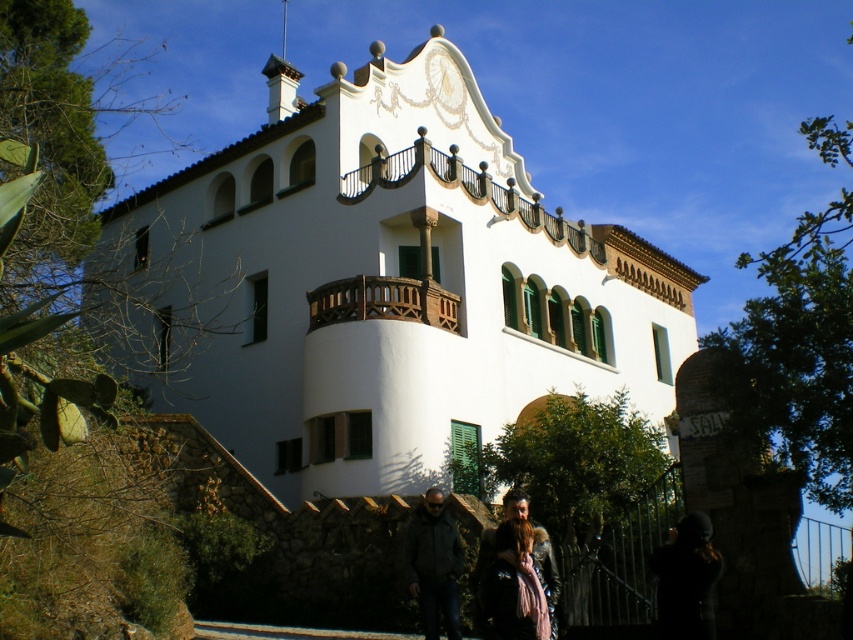
Question: Is white stucco building at center below leather jacket at lower center?

Choices:
 (A) yes
 (B) no

Answer: (B)

Question: Among these points, which one is nearest to the camera?

Choices:
 (A) (413, 548)
 (B) (718, 556)
 (C) (378, 456)
 (D) (514, 612)

Answer: (B)

Question: Can you confirm if white stucco building at center is positioned above dark gray jacket at center?

Choices:
 (A) no
 (B) yes

Answer: (B)

Question: Which object appears closest to the camera in this image?

Choices:
 (A) dark gray jacket at center
 (B) dark woolen hat at lower right
 (C) white stucco building at center

Answer: (B)

Question: Is dark woolen hat at lower right to the left of leather jacket at lower center from the viewer's perspective?

Choices:
 (A) no
 (B) yes

Answer: (A)

Question: Based on their relative distances, which object is nearer to the dark gray jacket at center?

Choices:
 (A) leather jacket at lower center
 (B) dark woolen hat at lower right

Answer: (A)